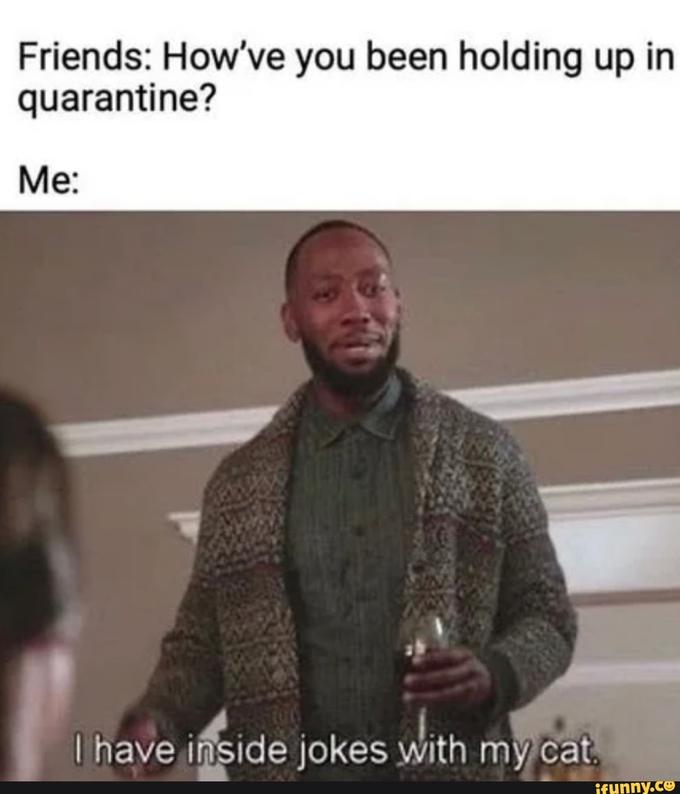
Locate an element on the screen. white trim piece highest is located at coordinates (561, 395), (194, 425).